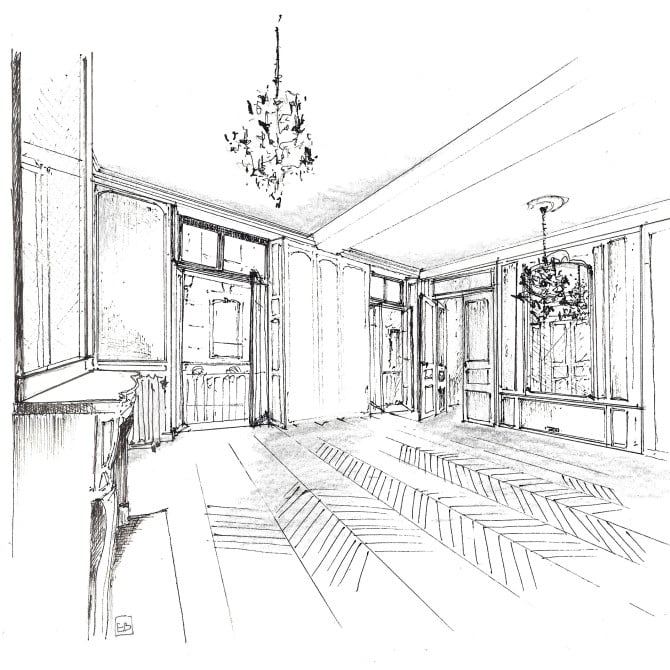
Locate an element on the screen. mirror is located at coordinates (65, 254).